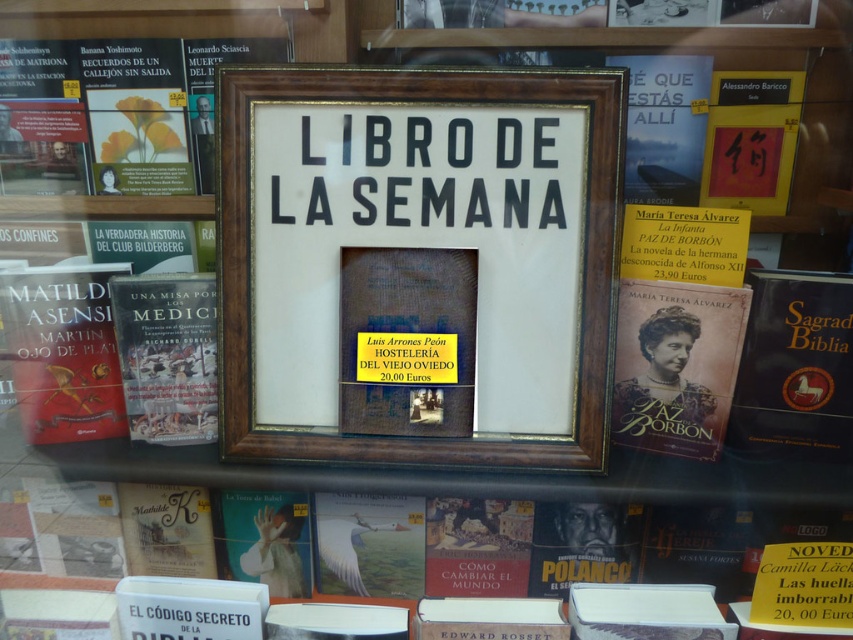
Is point (4, 316) closer to camera compared to point (142, 344)?

That is True.

Who is more forward, (62, 284) or (215, 336)?

Point (62, 284) is in front.

This screenshot has height=640, width=853. Find the location of `matte red book at left`. matte red book at left is located at coordinates (62, 352).

The width and height of the screenshot is (853, 640). I want to click on brown leather book at right, so click(795, 368).

The width and height of the screenshot is (853, 640). Identify the location of brown leather book at right. point(795,368).

Measure the distance between matte gold book at center and red matte book at upper right.

matte gold book at center is 7.73 inches away from red matte book at upper right.

Which is more to the right, matte gold book at center or red matte book at upper right?

From the viewer's perspective, red matte book at upper right appears more on the right side.

What do you see at coordinates (675, 365) in the screenshot? I see `matte gold book at center` at bounding box center [675, 365].

Identify the location of matte gold book at center. (675, 365).